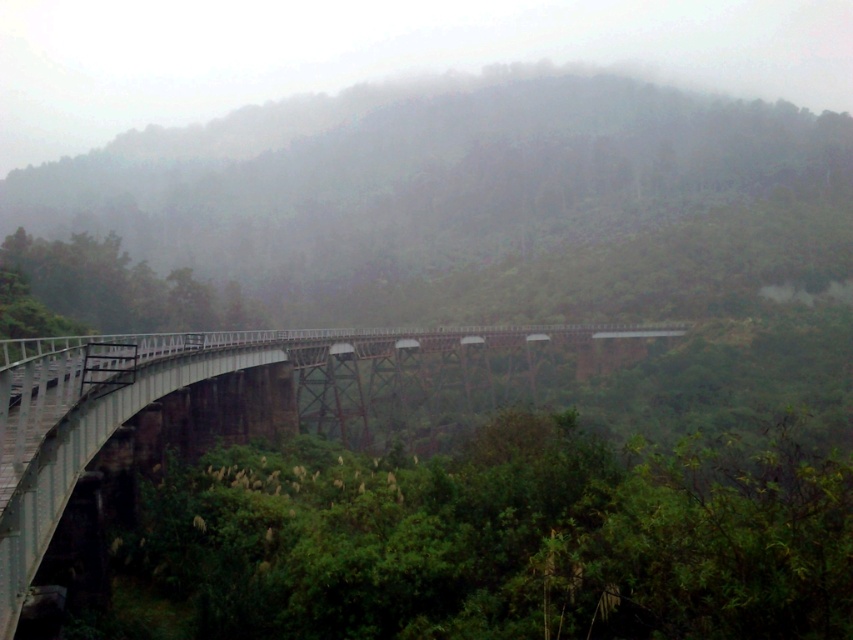
Question: Does foggy forest at center appear over white metallic bridge at lower left?

Choices:
 (A) no
 (B) yes

Answer: (B)

Question: Can you confirm if foggy forest at center is smaller than white metallic bridge at lower left?

Choices:
 (A) no
 (B) yes

Answer: (A)

Question: Does foggy forest at center appear on the right side of white metallic bridge at lower left?

Choices:
 (A) yes
 (B) no

Answer: (B)

Question: Which object appears farthest from the camera in this image?

Choices:
 (A) white metallic bridge at lower left
 (B) foggy forest at center

Answer: (B)

Question: Among these points, which one is farthest from the camera?

Choices:
 (A) (10, 364)
 (B) (631, 156)

Answer: (B)